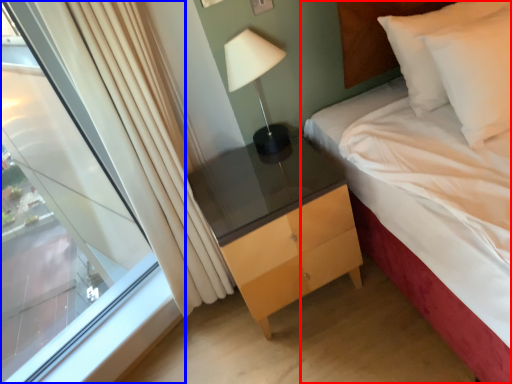
Question: Which object appears closest to the camera in this image, bed (highlighted by a red box) or window (highlighted by a blue box)?

Choices:
 (A) bed
 (B) window

Answer: (A)